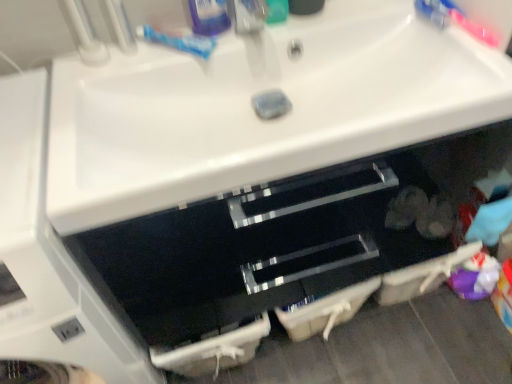
Identify the location of vacant space to the left of matte plastic faucet at upper center. This screenshot has width=512, height=384. (197, 49).